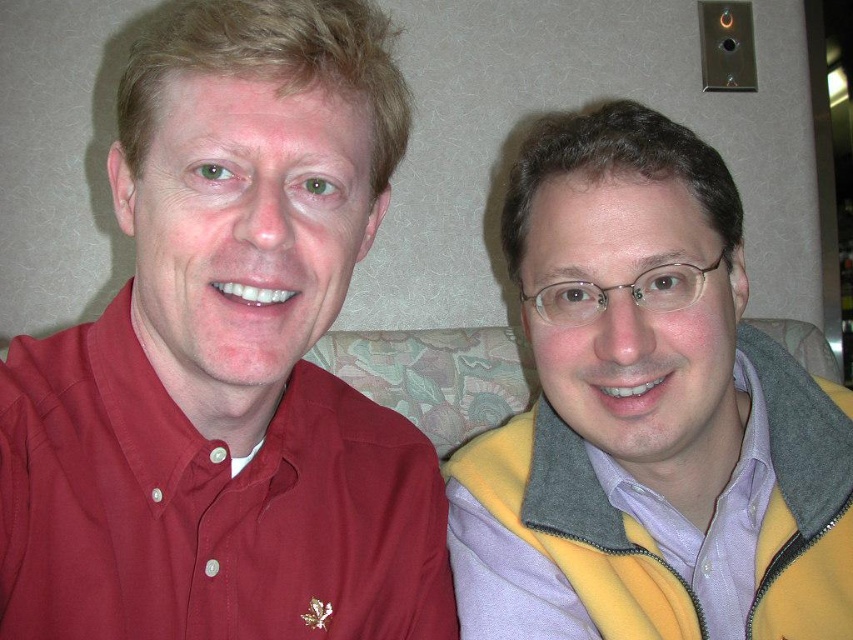
Question: Which point is closer to the camera?

Choices:
 (A) matte red shirt at left
 (B) floral fabric couch at center

Answer: (A)

Question: Is yellow fleece vest at right above purple cotton shirt at right?

Choices:
 (A) no
 (B) yes

Answer: (B)

Question: Is matte red shirt at left further to the viewer compared to yellow fleece vest at right?

Choices:
 (A) yes
 (B) no

Answer: (B)

Question: Which point is closer to the camera?

Choices:
 (A) (410, 346)
 (B) (198, 392)

Answer: (B)

Question: Is yellow fleece vest at right further to camera compared to purple cotton shirt at right?

Choices:
 (A) yes
 (B) no

Answer: (B)

Question: Which point is closer to the camera?

Choices:
 (A) yellow fleece vest at right
 (B) purple cotton shirt at right
 (C) matte red shirt at left
 (D) floral fabric couch at center

Answer: (C)